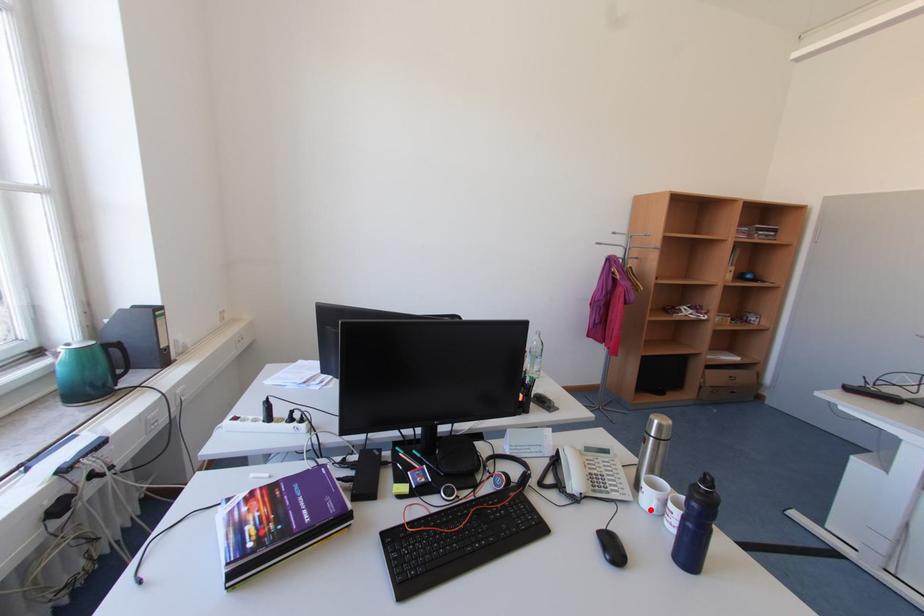
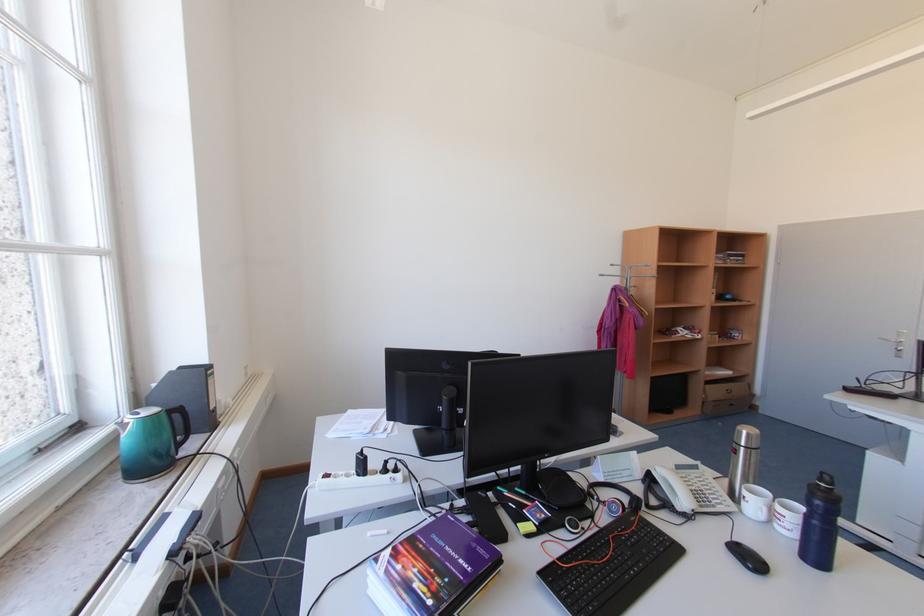
In the second image, find the point that corresponds to the highlighted location in the first image.

(757, 519)